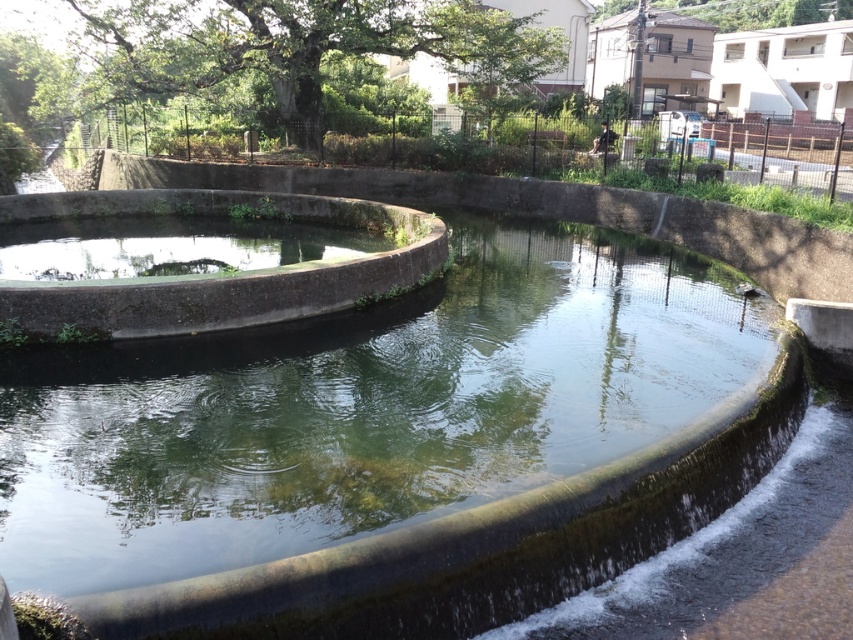
You are standing in the park and see the smooth concrete fountain at center and the smooth concrete basin at center. Which one is positioned lower in the scene?

The smooth concrete fountain at center is located below the smooth concrete basin at center, so it is positioned lower in the scene.

You are standing in the outdoor scene looking at the curved concrete structure. There are two points marked on the structure at coordinates point (242, 595) and point (302, 268). Which point is nearer to you?

Point (242, 595) is closer to the viewer than point (302, 268).